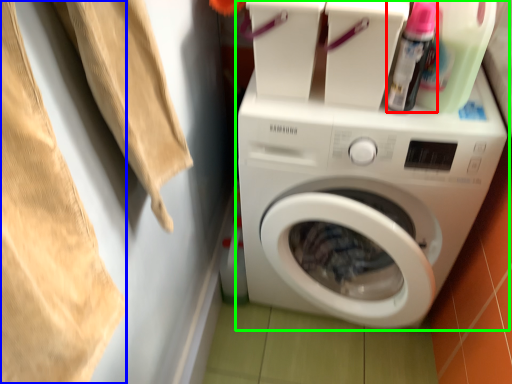
Question: Which object is the closest to the cleaning product (highlighted by a red box)? Choose among these: clothing (highlighted by a blue box) or washing machine (highlighted by a green box).

Choices:
 (A) clothing
 (B) washing machine

Answer: (B)